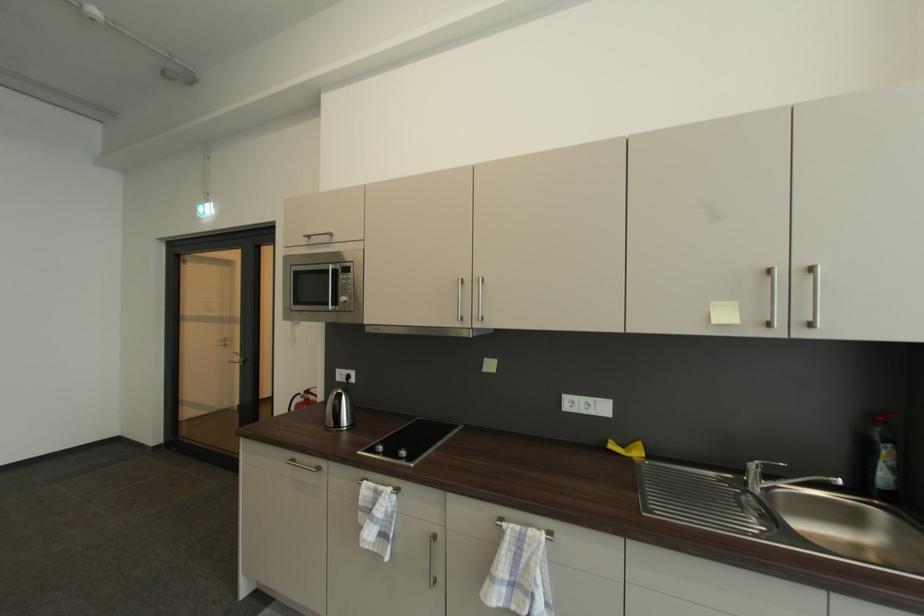
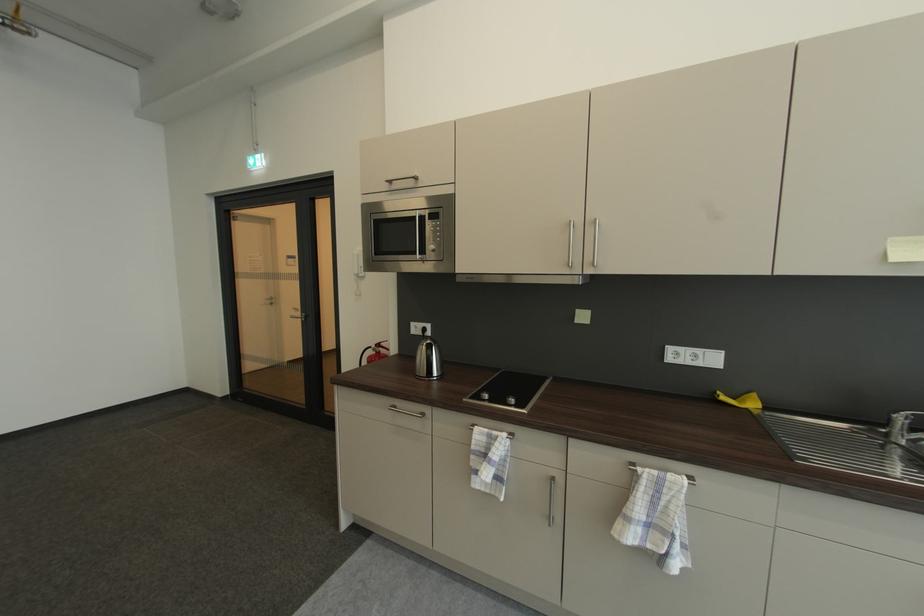
Where in the second image is the point corresponding to point (314, 392) from the first image?

(384, 347)